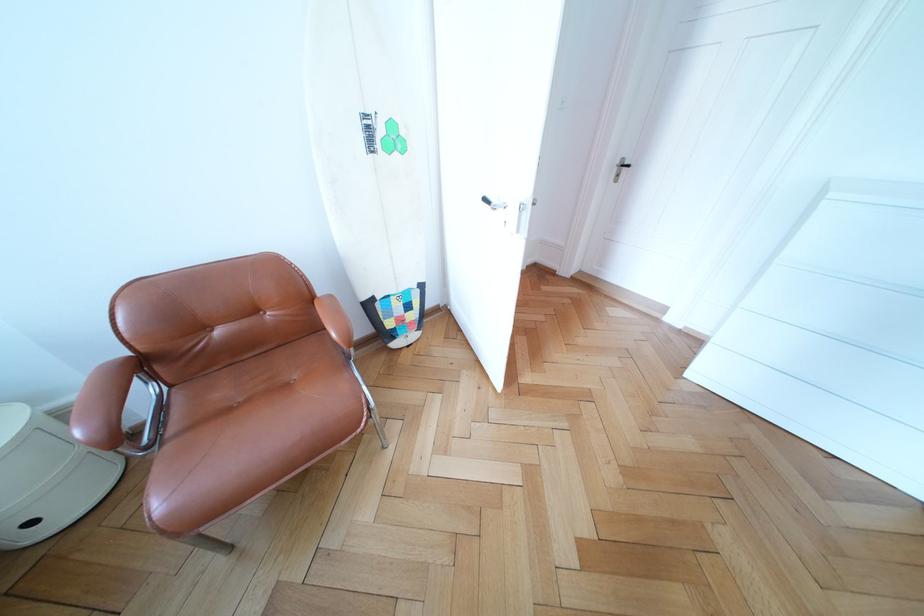
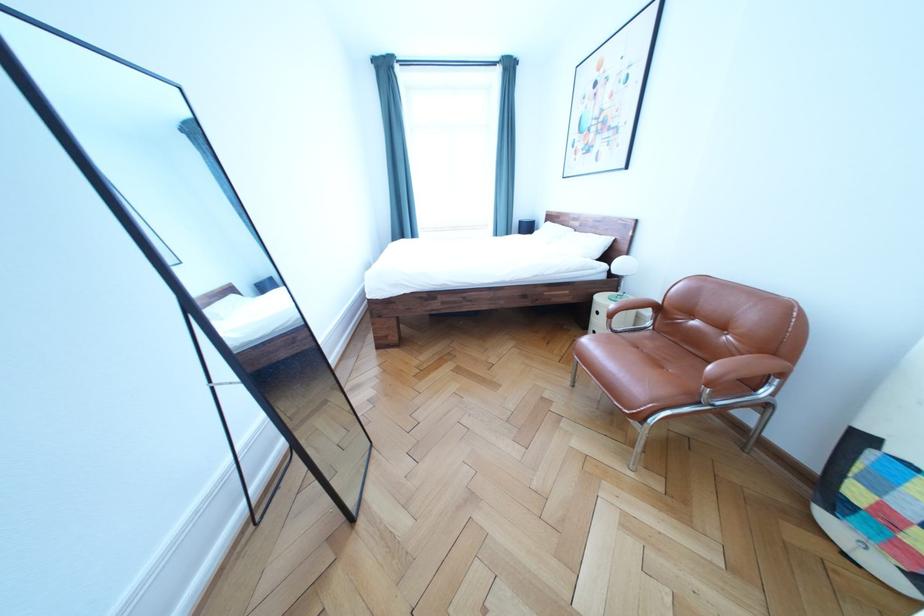
The point at [232,338] is marked in the first image. Where is the corresponding point in the second image?

(706, 329)